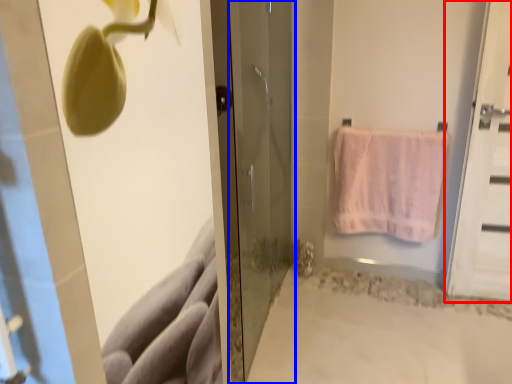
Question: Which of the following is the farthest to the observer, door (highlighted by a red box) or door (highlighted by a blue box)?

Choices:
 (A) door
 (B) door

Answer: (A)